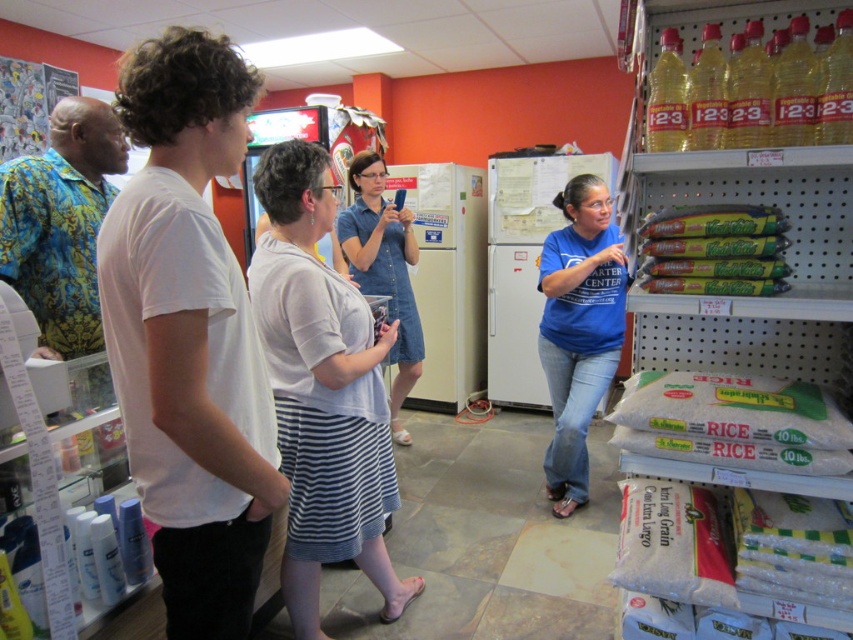
Is green matte fresh pasta at right above denim dress at center?

Correct, green matte fresh pasta at right is located above denim dress at center.

Between green matte fresh pasta at right and denim dress at center, which one is positioned lower?

denim dress at center

Consider the image. Measure the distance between point [715,257] and camera.

Point [715,257] is 1.31 meters away from camera.

At what (x,y) coordinates should I click in order to perform the action: click on green matte fresh pasta at right. Please return your answer as a coordinate pair (x, y). Looking at the image, I should click on [715, 250].

What do you see at coordinates (189, 333) in the screenshot? The height and width of the screenshot is (640, 853). I see `white cotton t-shirt at center` at bounding box center [189, 333].

Between point (157, 259) and point (807, 387), which one is positioned behind?

The point (807, 387) is more distant.

Identify the location of white cotton t-shirt at center. click(189, 333).

Is white cotton shirt at center bigger than denim dress at center?

Indeed, white cotton shirt at center has a larger size compared to denim dress at center.

This screenshot has height=640, width=853. In order to click on white cotton shirt at center in this screenshot , I will do `click(322, 392)`.

Which is behind, point (358, 520) or point (367, 211)?

The point (367, 211) is behind.

Image resolution: width=853 pixels, height=640 pixels. Identify the location of white cotton shirt at center. (322, 392).